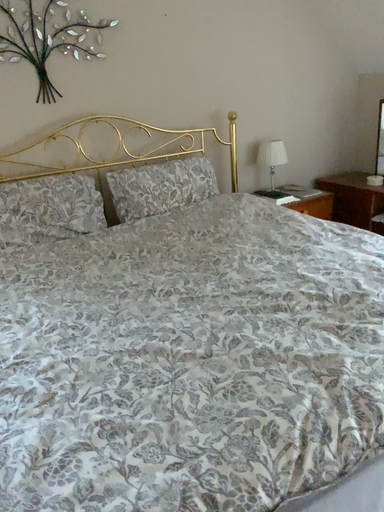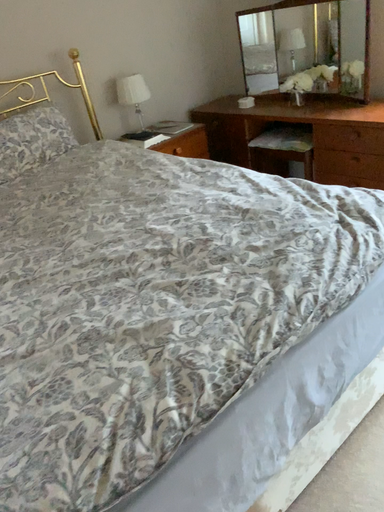
Question: How did the camera likely rotate when shooting the video?

Choices:
 (A) rotated upward
 (B) rotated downward

Answer: (B)